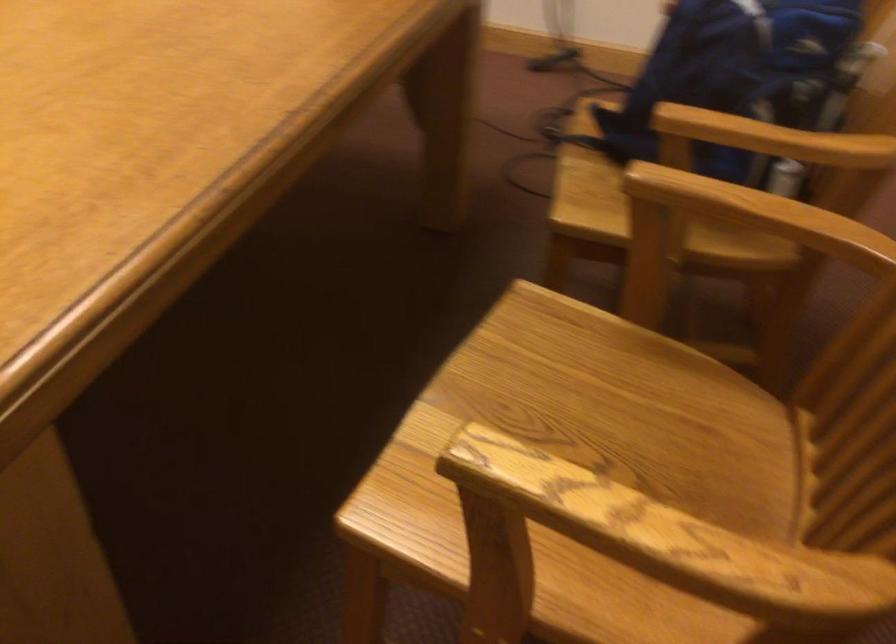
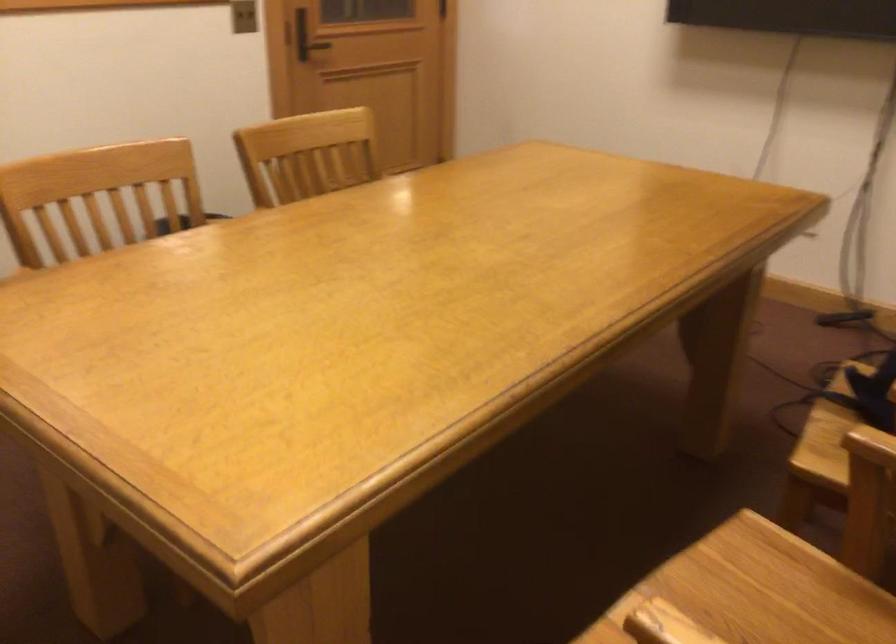
Locate, in the second image, the point that corresponds to (x=556, y=357) in the first image.

(764, 588)